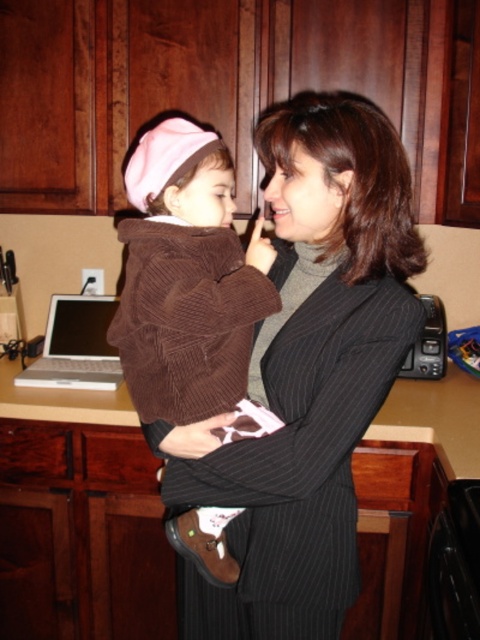
Who is taller, black pinstripe suit at center or brown corduroy sweater at center?

With more height is black pinstripe suit at center.

Which is in front, point (277, 225) or point (194, 196)?

Positioned in front is point (194, 196).

Who is more forward, (x=313, y=406) or (x=149, y=266)?

Point (x=313, y=406) is in front.

Image resolution: width=480 pixels, height=640 pixels. I want to click on black pinstripe suit at center, so click(308, 374).

Who is higher up, black pinstripe suit at center or white plastic laptop at lower left?

Positioned higher is white plastic laptop at lower left.

In the scene shown: Is black pinstripe suit at center bigger than white plastic laptop at lower left?

Correct, black pinstripe suit at center is larger in size than white plastic laptop at lower left.

This screenshot has height=640, width=480. Find the location of `black pinstripe suit at center`. black pinstripe suit at center is located at coordinates (308, 374).

From the picture: Can you confirm if brown corduroy sweater at center is thinner than white plastic laptop at lower left?

Correct, brown corduroy sweater at center's width is less than white plastic laptop at lower left's.

Is brown corduroy sweater at center smaller than white plastic laptop at lower left?

Incorrect, brown corduroy sweater at center is not smaller in size than white plastic laptop at lower left.

Is point (132, 241) closer to camera compared to point (60, 376)?

That is True.

The width and height of the screenshot is (480, 640). I want to click on brown corduroy sweater at center, so click(x=187, y=278).